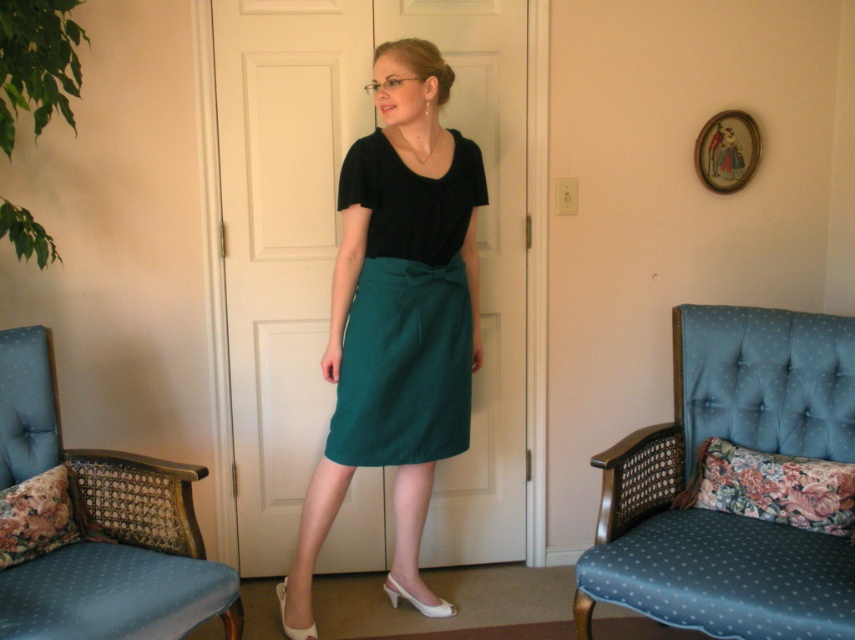
This screenshot has height=640, width=855. What do you see at coordinates (728, 513) in the screenshot?
I see `blue fabric armchair at right` at bounding box center [728, 513].

Is blue fabric armchair at right further to camera compared to teal fabric skirt at center?

No, blue fabric armchair at right is closer to the viewer.

Measure the distance between blue fabric armchair at right and camera.

blue fabric armchair at right is 1.67 meters away from camera.

Find the location of a particular element. The height and width of the screenshot is (640, 855). blue fabric armchair at right is located at coordinates (728, 513).

Who is positioned more to the left, teal fabric skirt at center or blue fabric armchair at left?

blue fabric armchair at left

Does point (382, 365) lie behind point (146, 506)?

Yes, it is.

Find the location of a particular element. This screenshot has height=640, width=855. teal fabric skirt at center is located at coordinates (405, 310).

Is blue fabric armchair at right thinner than blue fabric armchair at left?

Incorrect, blue fabric armchair at right's width is not less than blue fabric armchair at left's.

Is blue fabric armchair at right to the right of blue fabric armchair at left from the viewer's perspective?

Indeed, blue fabric armchair at right is positioned on the right side of blue fabric armchair at left.

Is point (792, 630) more distant than point (96, 605)?

No.

Find the location of a particular element. This screenshot has width=855, height=640. blue fabric armchair at right is located at coordinates (728, 513).